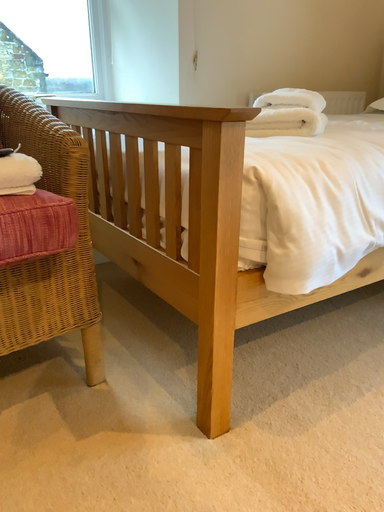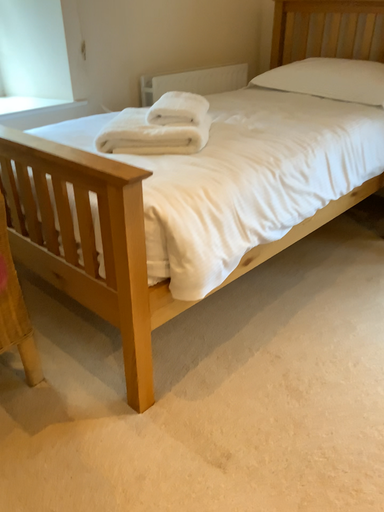
Question: How did the camera likely rotate when shooting the video?

Choices:
 (A) rotated downward
 (B) rotated upward

Answer: (A)